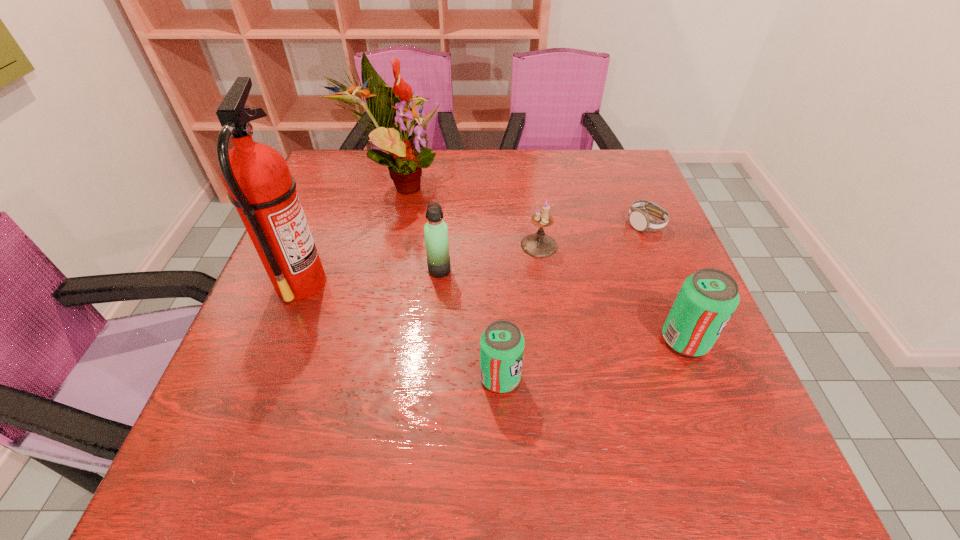
The width and height of the screenshot is (960, 540). I want to click on watch situated at the right edge, so click(x=640, y=220).

This screenshot has height=540, width=960. I want to click on object positioned at the far left corner, so click(x=388, y=107).

Locate an element on the screen. Image resolution: width=960 pixels, height=540 pixels. vacant space at the far edge of the desktop is located at coordinates (524, 184).

You are a GUI agent. You are given a task and a screenshot of the screen. Output one action in this format:
    pyautogui.click(x=<x>, y=<y>)
    Task: Click on the vacant region at the near edge of the desktop
    This screenshot has width=960, height=540.
    Given the screenshot: What is the action you would take?
    pyautogui.click(x=493, y=415)

Locate an element on the screen. free space at the left edge of the desktop is located at coordinates (338, 295).

The image size is (960, 540). In the image, there is a desktop. Identify the location of vacant space at the right edge. (646, 292).

Find the location of a particular element. This screenshot has width=960, height=540. free space at the far right corner of the desktop is located at coordinates (610, 174).

Find the location of a particular element. The height and width of the screenshot is (540, 960). free space between the sixth shortest object and the watch is located at coordinates (520, 204).

Where is `free point between the farthest object and the right pop soda`? free point between the farthest object and the right pop soda is located at coordinates (540, 262).

At what (x,y) coordinates should I click in order to perform the action: click on unoccupied position between the bouquet and the fire extinguisher. Please return your answer as a coordinate pair (x, y). This screenshot has width=960, height=540. Looking at the image, I should click on (348, 233).